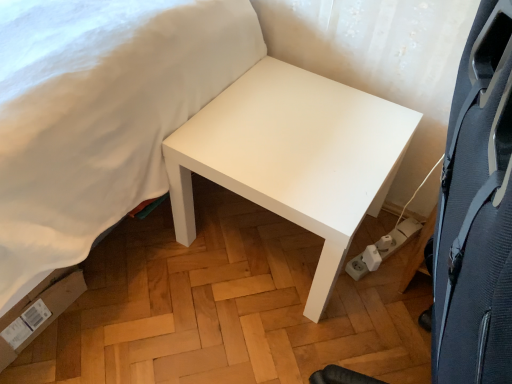
I want to click on blank space situated above white matte table at center (from a real-world perspective), so click(288, 141).